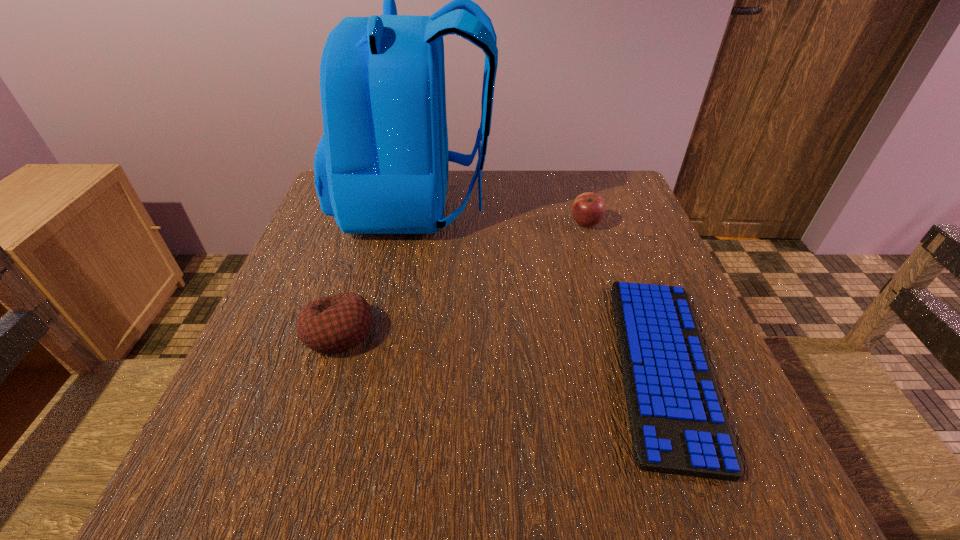
The image size is (960, 540). I want to click on free space that satisfies the following two spatial constraints: 1. on the back of the apple; 2. on the right side of the tallest object, so click(x=414, y=224).